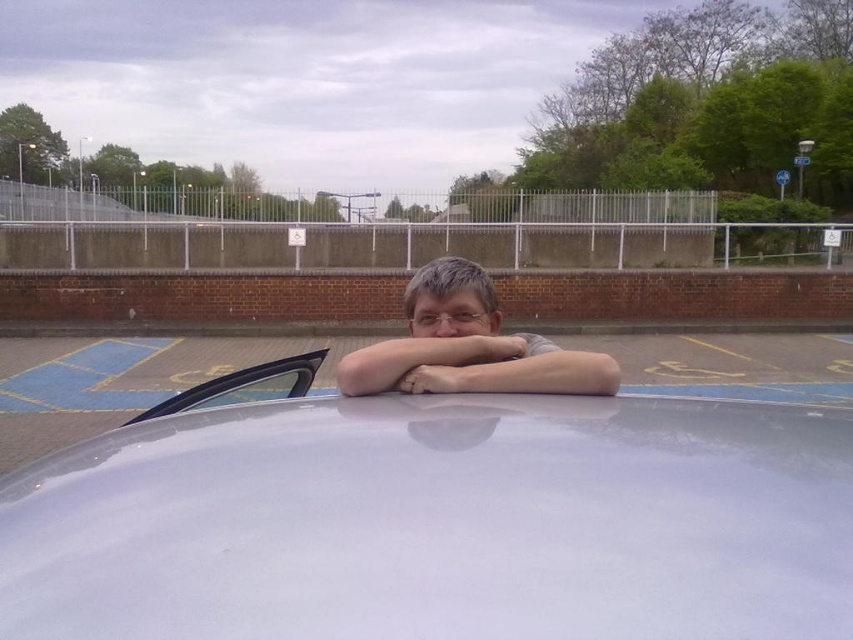
Question: Can you confirm if white glossy car at center is positioned to the left of matte gray shirt at center?

Choices:
 (A) yes
 (B) no

Answer: (B)

Question: Based on their relative distances, which object is nearer to the white glossy car at center?

Choices:
 (A) matte gray shirt at center
 (B) transparent glass windshield at upper left

Answer: (A)

Question: Which is farther from the transparent glass windshield at upper left?

Choices:
 (A) white glossy car at center
 (B) matte gray shirt at center

Answer: (A)

Question: Among these objects, which one is nearest to the camera?

Choices:
 (A) matte gray shirt at center
 (B) white glossy car at center
 (C) transparent glass windshield at upper left

Answer: (B)

Question: Is white glossy car at center wider than matte gray shirt at center?

Choices:
 (A) no
 (B) yes

Answer: (B)

Question: Can you confirm if matte gray shirt at center is smaller than transparent glass windshield at upper left?

Choices:
 (A) yes
 (B) no

Answer: (B)